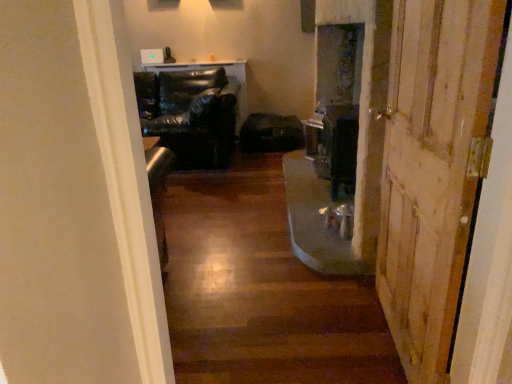
Question: Is black leather chair at center surrounding wooden floor at center?

Choices:
 (A) yes
 (B) no

Answer: (B)

Question: Is black leather chair at center bigger than wooden floor at center?

Choices:
 (A) no
 (B) yes

Answer: (B)

Question: From the image's perspective, does black leather chair at center appear lower than wooden floor at center?

Choices:
 (A) yes
 (B) no

Answer: (B)

Question: Is black leather chair at center further to the viewer compared to wooden floor at center?

Choices:
 (A) yes
 (B) no

Answer: (A)

Question: Is black leather chair at center at the left side of wooden floor at center?

Choices:
 (A) no
 (B) yes

Answer: (B)

Question: Can you confirm if black leather chair at center is thinner than wooden floor at center?

Choices:
 (A) yes
 (B) no

Answer: (A)

Question: Is wooden floor at center thinner than black leather chair at center?

Choices:
 (A) no
 (B) yes

Answer: (A)

Question: Can you confirm if wooden floor at center is wider than black leather chair at center?

Choices:
 (A) no
 (B) yes

Answer: (B)

Question: Is wooden floor at center positioned in front of black leather chair at center?

Choices:
 (A) yes
 (B) no

Answer: (A)

Question: Would you say wooden floor at center contains black leather chair at center?

Choices:
 (A) yes
 (B) no

Answer: (B)

Question: Is wooden floor at center positioned far away from black leather chair at center?

Choices:
 (A) no
 (B) yes

Answer: (B)

Question: Is wooden floor at center taller than black leather chair at center?

Choices:
 (A) yes
 (B) no

Answer: (B)

Question: From the image's perspective, does black leather chair at center appear higher than wooden door at right?

Choices:
 (A) yes
 (B) no

Answer: (A)